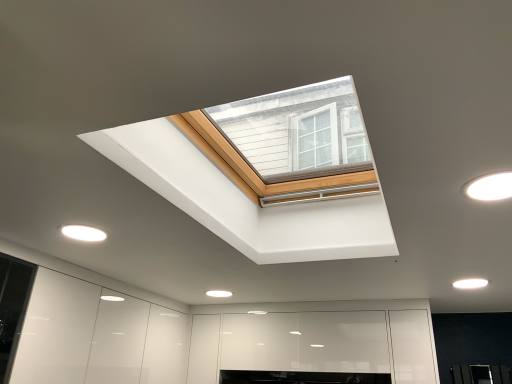
Question: Do you think white matte light fixture at upper right, which ranks as the first lighting in front-to-back order, is within white matte light fixture at lower right, which ranks as the 3th lighting in top-to-bottom order, or outside of it?

Choices:
 (A) outside
 (B) inside

Answer: (A)

Question: Is white matte light fixture at upper right, positioned as the second lighting in right-to-left order, wider or thinner than white matte light fixture at lower right, the 1th lighting when ordered from back to front?

Choices:
 (A) wide
 (B) thin

Answer: (A)

Question: Estimate the real-world distances between objects in this image. Which object is closer to the white matte light fixture at lower right, arranged as the third lighting when viewed from the left?

Choices:
 (A) white matte light fixture at upper right, which ranks as the first lighting in front-to-back order
 (B) white glossy light fixture at lower left, marked as the 2th lighting in a back-to-front arrangement

Answer: (A)

Question: Which object is the farthest from the white glossy light fixture at lower left, the 1th lighting when ordered from left to right?

Choices:
 (A) white matte light fixture at upper right, which is the 2th lighting in left-to-right order
 (B) white matte light fixture at lower right, which ranks as the third lighting in front-to-back order

Answer: (B)